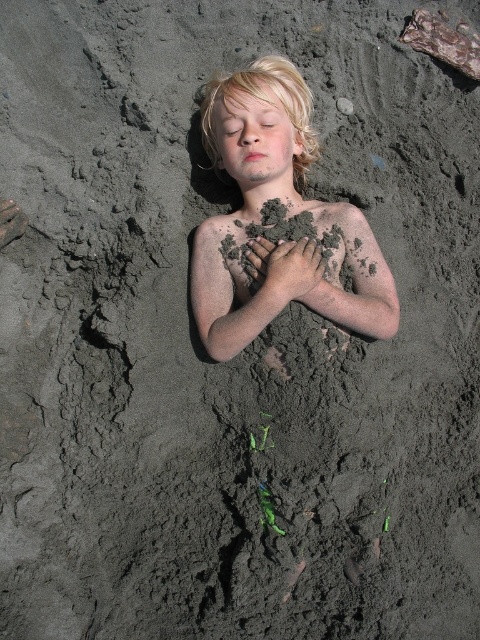
Question: Is matte sand child at center closer to the viewer compared to dark brown mud hand at center?

Choices:
 (A) no
 (B) yes

Answer: (B)

Question: Among these objects, which one is farthest from the camera?

Choices:
 (A) dark brown mud hand at center
 (B) matte sand child at center

Answer: (A)

Question: Observing the image, what is the correct spatial positioning of matte sand child at center in reference to dark brown mud hand at center?

Choices:
 (A) right
 (B) left

Answer: (B)

Question: Is matte sand child at center further to the viewer compared to dark brown mud hand at center?

Choices:
 (A) no
 (B) yes

Answer: (A)